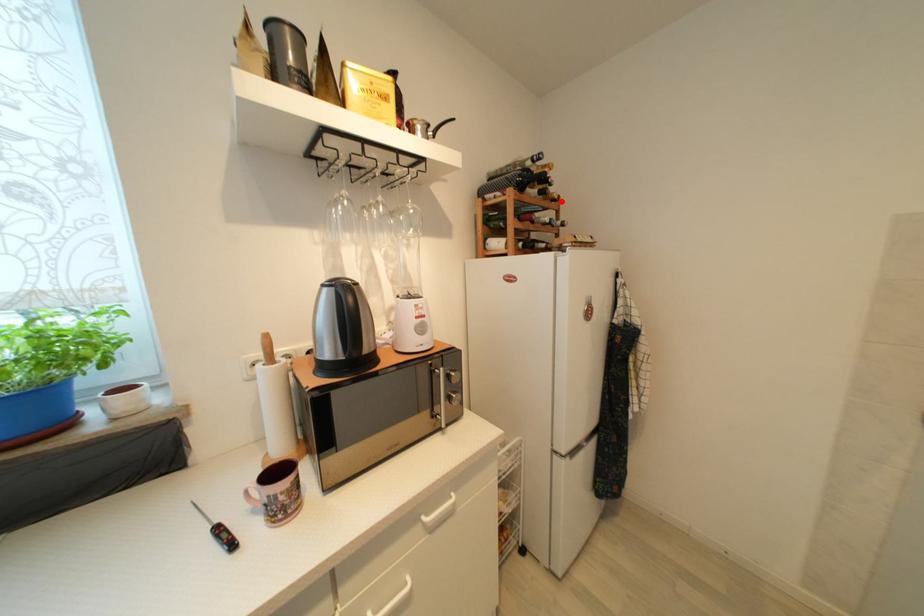
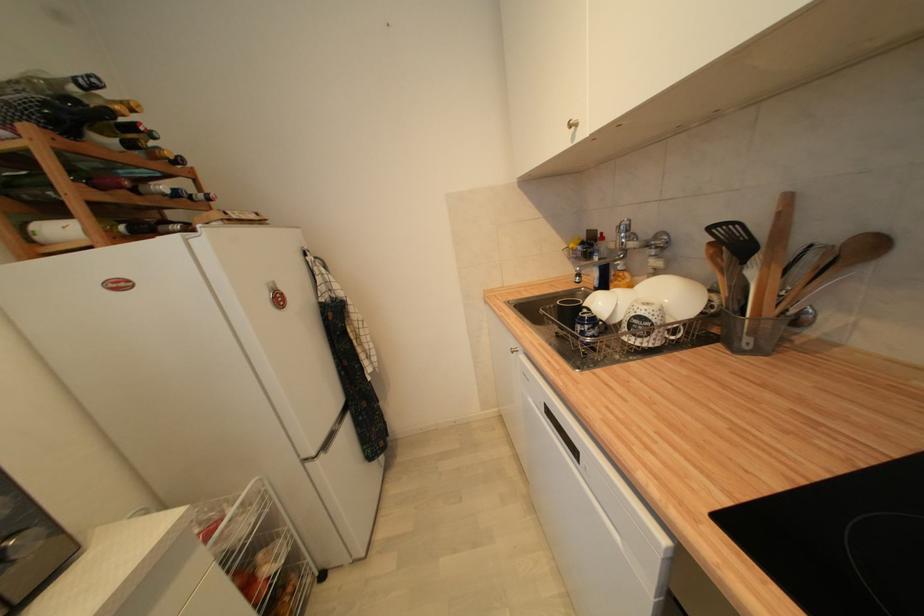
Where in the second image is the point corresponding to the highlighted location from the first image?

(186, 164)